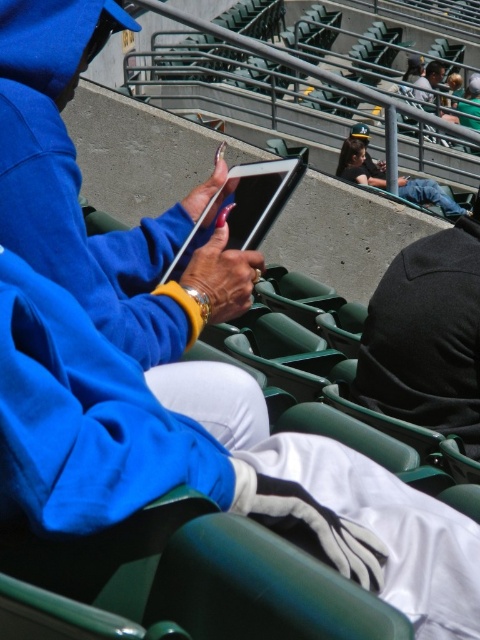
Question: Which point appears closest to the camera in this image?

Choices:
 (A) (299, 157)
 (B) (428, 262)

Answer: (A)

Question: Can you confirm if dark gray fabric jacket at center is positioned below matte black tablet at center?

Choices:
 (A) yes
 (B) no

Answer: (A)

Question: Is dark gray fabric jacket at center above matte black tablet at center?

Choices:
 (A) yes
 (B) no

Answer: (B)

Question: Which of the following is the closest to the observer?

Choices:
 (A) (429, 406)
 (B) (191, 248)

Answer: (B)

Question: From the image, what is the correct spatial relationship of dark gray fabric jacket at center in relation to matte black tablet at center?

Choices:
 (A) right
 (B) left

Answer: (A)